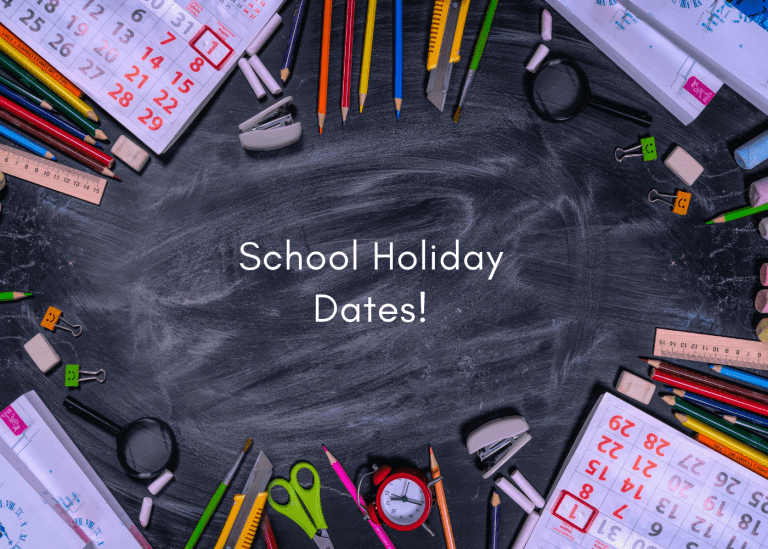
Find the location of `book`. book is located at coordinates (707, 29), (663, 55), (15, 473), (75, 487).